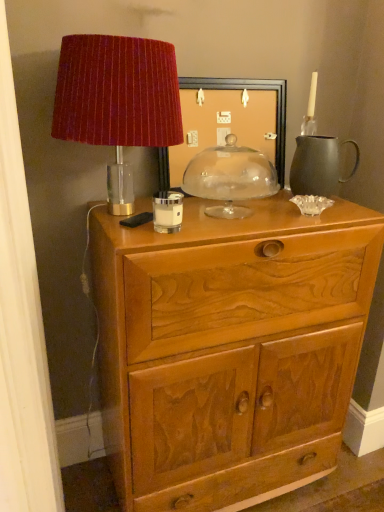
Question: Is wooden carved chest of drawers at center wider than velvet red lampshade at upper left?

Choices:
 (A) no
 (B) yes

Answer: (B)

Question: Is wooden carved chest of drawers at center not inside velvet red lampshade at upper left?

Choices:
 (A) no
 (B) yes

Answer: (B)

Question: Considering the relative sizes of wooden carved chest of drawers at center and velvet red lampshade at upper left in the image provided, is wooden carved chest of drawers at center shorter than velvet red lampshade at upper left?

Choices:
 (A) yes
 (B) no

Answer: (B)

Question: Could velvet red lampshade at upper left be considered to be inside wooden carved chest of drawers at center?

Choices:
 (A) yes
 (B) no

Answer: (B)

Question: Is velvet red lampshade at upper left at the back of wooden carved chest of drawers at center?

Choices:
 (A) no
 (B) yes

Answer: (A)

Question: Is transparent glass dome at center, the first candle holder from the back, inside or outside of matte black pitcher at right?

Choices:
 (A) outside
 (B) inside

Answer: (A)

Question: Looking at the image, does transparent glass dome at center, the first candle holder from the back, seem bigger or smaller compared to matte black pitcher at right?

Choices:
 (A) small
 (B) big

Answer: (B)

Question: From the image's perspective, is transparent glass dome at center, which appears as the 1th candle holder when viewed from the right, above or below matte black pitcher at right?

Choices:
 (A) below
 (B) above

Answer: (A)

Question: Looking at their shapes, would you say transparent glass dome at center, which appears as the 1th candle holder when viewed from the right, is wider or thinner than matte black pitcher at right?

Choices:
 (A) thin
 (B) wide

Answer: (B)

Question: Based on their positions, is matte black pitcher at right located to the left or right of transparent glass dome at center, the second candle holder from the front?

Choices:
 (A) right
 (B) left

Answer: (A)

Question: Is point (322, 195) closer or farther from the camera than point (225, 192)?

Choices:
 (A) closer
 (B) farther

Answer: (A)

Question: Considering their positions, is matte black pitcher at right located in front of or behind transparent glass dome at center, the first candle holder from the back?

Choices:
 (A) behind
 (B) front

Answer: (A)

Question: Looking at the image, does matte black pitcher at right seem bigger or smaller compared to transparent glass dome at center, the first candle holder from the back?

Choices:
 (A) small
 (B) big

Answer: (A)

Question: From a real-world perspective, is matte black picture frame at center positioned above or below transparent glass dome at center, the 2th candle holder positioned from the left?

Choices:
 (A) above
 (B) below

Answer: (A)

Question: From their relative heights in the image, would you say matte black picture frame at center is taller or shorter than transparent glass dome at center, the second candle holder from the front?

Choices:
 (A) tall
 (B) short

Answer: (A)